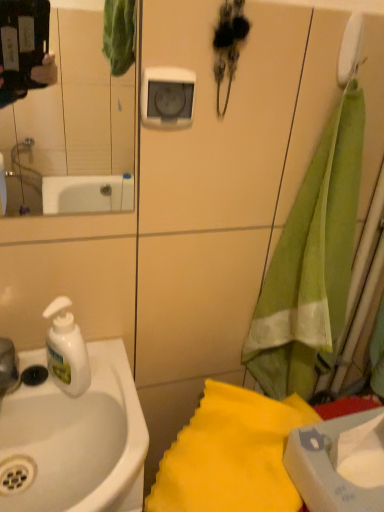
Question: Is green fabric towel at right, the first beach towel positioned from the top, thinner than white plastic faucet at left?

Choices:
 (A) yes
 (B) no

Answer: (B)

Question: Can you confirm if green fabric towel at right, the first beach towel positioned from the top, is smaller than white plastic faucet at left?

Choices:
 (A) no
 (B) yes

Answer: (A)

Question: Are green fabric towel at right, the first beach towel positioned from the top, and white plastic faucet at left located far from each other?

Choices:
 (A) no
 (B) yes

Answer: (A)

Question: Is green fabric towel at right, the first beach towel positioned from the top, touching white plastic faucet at left?

Choices:
 (A) yes
 (B) no

Answer: (B)

Question: Is green fabric towel at right, the first beach towel positioned from the top, oriented away from white plastic faucet at left?

Choices:
 (A) yes
 (B) no

Answer: (B)

Question: Is clear glass mirror at upper left inside the boundaries of yellow fabric towel at lower right, the 2th beach towel in the top-to-bottom sequence, or outside?

Choices:
 (A) inside
 (B) outside

Answer: (B)

Question: Does point (33, 181) appear closer or farther from the camera than point (203, 421)?

Choices:
 (A) closer
 (B) farther

Answer: (B)

Question: Considering the positions of clear glass mirror at upper left and yellow fabric towel at lower right, the 1th beach towel in the bottom-to-top sequence, in the image, is clear glass mirror at upper left wider or thinner than yellow fabric towel at lower right, the 1th beach towel in the bottom-to-top sequence,?

Choices:
 (A) wide
 (B) thin

Answer: (B)

Question: From a real-world perspective, is clear glass mirror at upper left positioned above or below yellow fabric towel at lower right, the 1th beach towel in the bottom-to-top sequence?

Choices:
 (A) below
 (B) above

Answer: (B)

Question: Is white matte soap dispenser at left spatially inside white glossy sink at left, or outside of it?

Choices:
 (A) inside
 (B) outside

Answer: (B)

Question: Is white matte soap dispenser at left bigger or smaller than white glossy sink at left?

Choices:
 (A) big
 (B) small

Answer: (B)

Question: Considering the positions of white matte soap dispenser at left and white glossy sink at left in the image, is white matte soap dispenser at left taller or shorter than white glossy sink at left?

Choices:
 (A) short
 (B) tall

Answer: (B)

Question: In the image, is white matte soap dispenser at left positioned in front of or behind white glossy sink at left?

Choices:
 (A) behind
 (B) front

Answer: (A)

Question: Based on their positions, is white plastic faucet at left located to the left or right of green fabric towel at right, the first beach towel positioned from the top?

Choices:
 (A) left
 (B) right

Answer: (A)

Question: From a real-world perspective, relative to green fabric towel at right, the first beach towel positioned from the top, is white plastic faucet at left vertically above or below?

Choices:
 (A) above
 (B) below

Answer: (B)